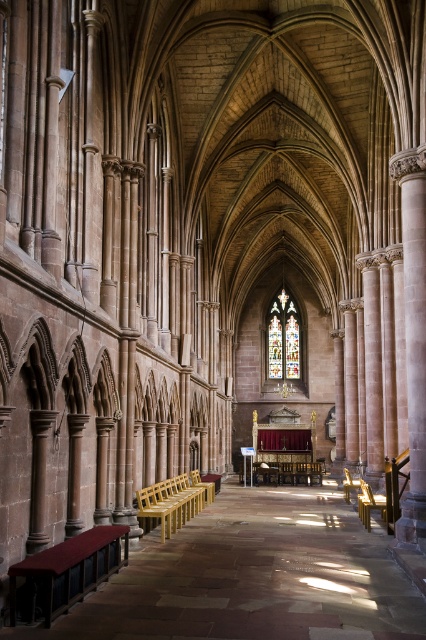
You are standing at the entrance of the cathedral and want to sit down. Which object from the golden polished wood bench at lower left would be the closest to you?

The golden polished wood bench at lower left is the only object mentioned, so it would be the closest to you as you are at the entrance.

You are standing in the cathedral and want to take a photo. You notice two points marked in the scene. Which of the two points, point 1 at coordinates point (204, 502) or point 2 at coordinates point (290, 310), is closer to your current position?

Point 1 at coordinates point (204, 502) is closer to your current position because it is closer to the camera than point 2 at coordinates point (290, 310).

You are an interior designer planning to rearrange the cathedral. You need to know which object takes up more space. Which occupies more area in the image, the golden polished wood bench at lower left or the stained glass at center?

The stained glass at center occupies more space than the golden polished wood bench at lower left, so the stained glass at center takes up more area.